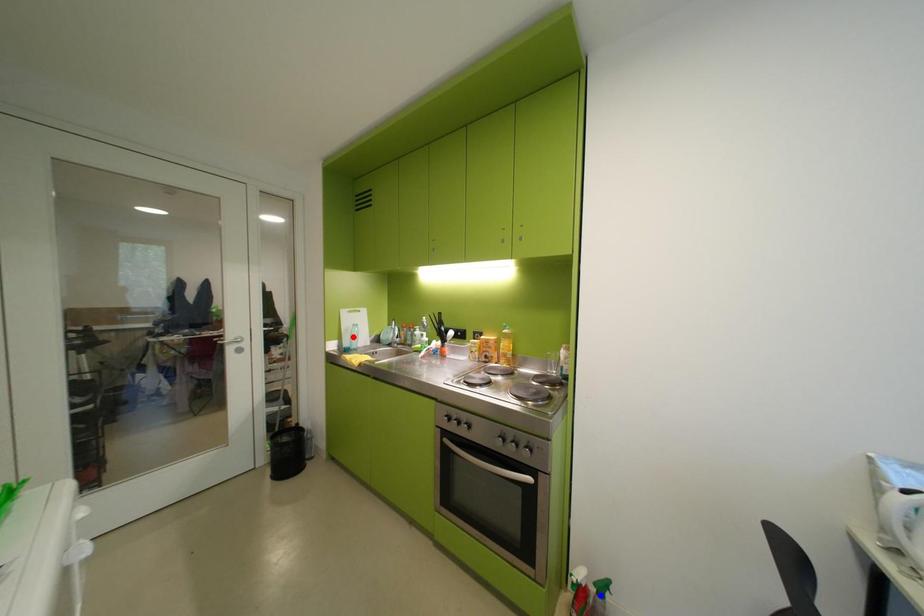
Question: Two points are marked on the image. Which point is closer to the camera?

Choices:
 (A) Blue point is closer.
 (B) Red point is closer.

Answer: (A)